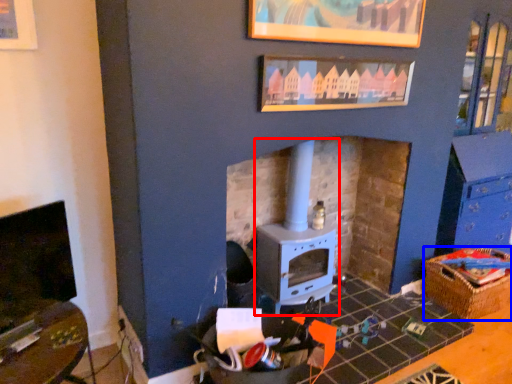
Question: Among these objects, which one is nearest to the camera, wood burning stove (highlighted by a red box) or crate (highlighted by a blue box)?

Choices:
 (A) wood burning stove
 (B) crate

Answer: (A)